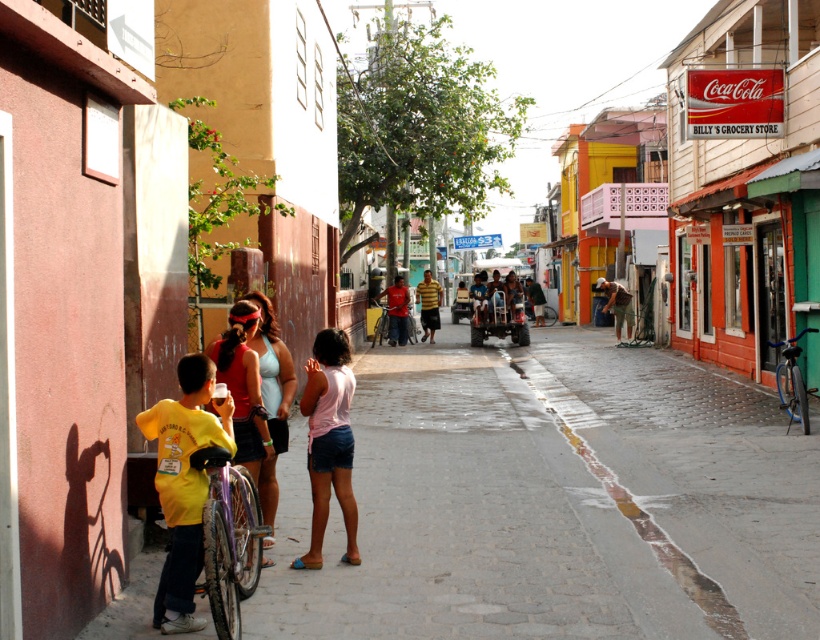
Consider the image. You are a tourist standing in the street scene and want to take a photo of both the yellow striped shirt at center and the metallic silver cart at center. Which object should you focus on first to ensure both are in the frame?

You should focus on the yellow striped shirt at center first because it is closer to you than the metallic silver cart at center, ensuring both are in the frame.

You are standing at the point marked by point (427, 305) in the image. What is the nearest object to you?

The nearest object to you is the yellow striped shirt at center, as the point marks its location.

You are standing at the entrance of the street and want to find the matte blue shirt at center. According to the coordinates given, where should you look relative to the entrance?

The matte blue shirt at center is located at coordinates point (395, 310), which is near the center of the image. Since you are at the entrance, you should look straight ahead towards the center of the street to find it.